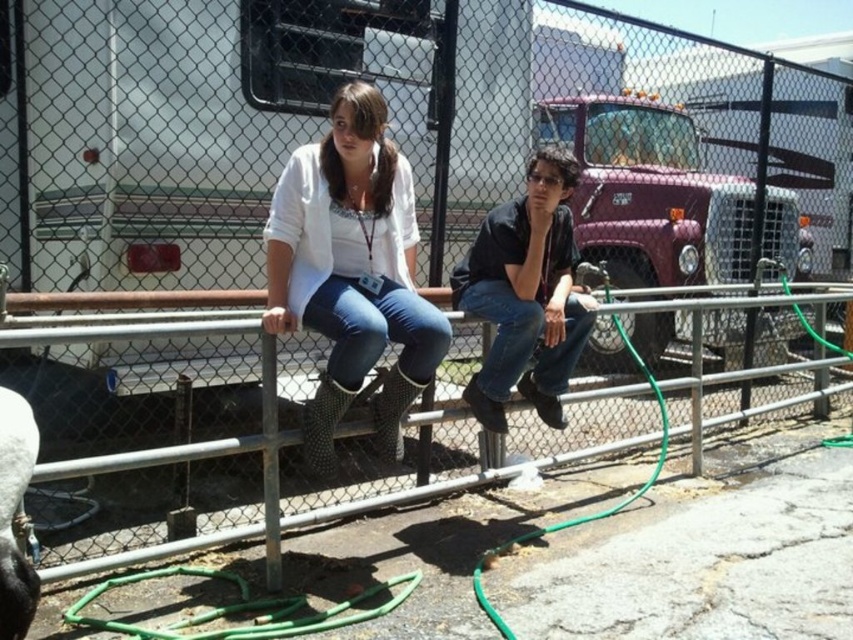
You are standing at the origin point of the coordinate system, facing the image. There is a point marked at coordinates point (410,140). What object is located at that point?

The point (410,140) marks the white plastic trailer at upper left.

You are a delivery driver who needs to park your truck behind the white plastic trailer at upper left to unload goods. However, there is a white matte boots at left in the way. Can you safely move the boots to the side to access the parking spot behind the trailer?

The white plastic trailer at upper left is further to the viewer than white matte boots at left, so the boots are closer to you. You can move the white matte boots at left out of the way to access the parking spot behind the white plastic trailer at upper left.

You are a delivery driver who needs to park your truck in the parking lot behind the white plastic trailer at upper left and the white matte boots at left. Which object should you use as a reference point to ensure proper parking alignment?

The white plastic trailer at upper left is positioned on the right side of white matte boots at left, so you should align your truck with the white plastic trailer at upper left to ensure proper parking alignment since it is further to the right compared to the white matte boots at left.